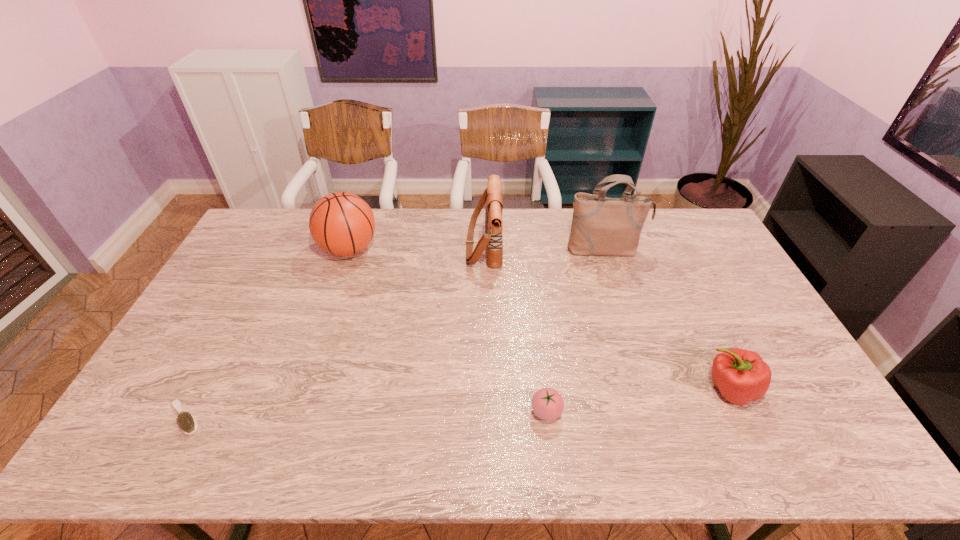
Locate an element on the screen. free space at the near right corner of the desktop is located at coordinates [820, 449].

This screenshot has height=540, width=960. Find the location of `vacant area between the third object from left to right and the fourth object from left to right`. vacant area between the third object from left to right and the fourth object from left to right is located at coordinates (515, 328).

This screenshot has width=960, height=540. In order to click on free space between the fourth object from right to left and the rightmost object in this screenshot , I will do `click(607, 317)`.

In order to click on vacant region between the fourth tallest object and the shorter shoulder bag in this screenshot , I will do `click(607, 317)`.

Where is `empty space that is in between the fourth object from right to left and the fourth object from left to right`? The height and width of the screenshot is (540, 960). empty space that is in between the fourth object from right to left and the fourth object from left to right is located at coordinates (515, 328).

This screenshot has width=960, height=540. Find the location of `free spot between the fifth object from right to left and the fourth tallest object`. free spot between the fifth object from right to left and the fourth tallest object is located at coordinates (540, 319).

Locate an element on the screen. vacant point located between the left shoulder bag and the tomato is located at coordinates (515, 328).

I want to click on empty location between the fifth object from left to right and the tomato, so click(x=576, y=330).

Where is `empty location between the shortest object and the tomato`? Image resolution: width=960 pixels, height=540 pixels. empty location between the shortest object and the tomato is located at coordinates (366, 415).

This screenshot has width=960, height=540. In order to click on free spot between the second shortest object and the shortest object in this screenshot , I will do `click(366, 415)`.